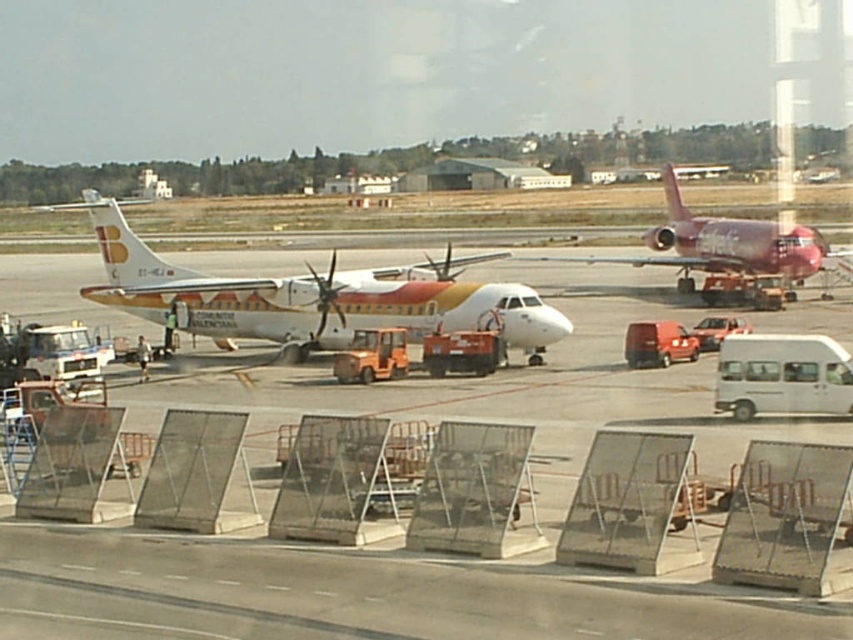
Based on the photo, is white glossy tarmac at center to the left of white glossy airplane at center from the viewer's perspective?

Incorrect, white glossy tarmac at center is not on the left side of white glossy airplane at center.

Can you confirm if white glossy tarmac at center is shorter than white glossy airplane at center?

Yes.

Identify the location of white glossy tarmac at center. [x=376, y=593].

From the picture: Can you confirm if white glossy airplane at center is positioned below shiny red airplane at center?

Incorrect, white glossy airplane at center is not positioned below shiny red airplane at center.

This screenshot has height=640, width=853. What are the coordinates of `white glossy airplane at center` in the screenshot? It's located at (310, 296).

Is white glossy tarmac at center shorter than shiny red airplane at center?

Yes, white glossy tarmac at center is shorter than shiny red airplane at center.

At what (x,y) coordinates should I click in order to perform the action: click on white glossy tarmac at center. Please return your answer as a coordinate pair (x, y). This screenshot has height=640, width=853. Looking at the image, I should click on (376, 593).

Image resolution: width=853 pixels, height=640 pixels. What are the coordinates of `white glossy tarmac at center` in the screenshot? It's located at tap(376, 593).